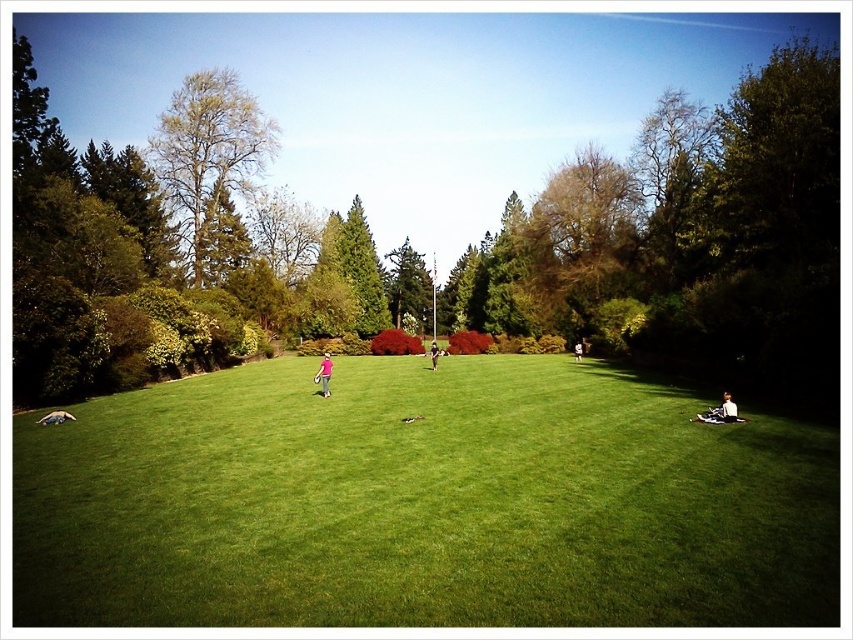
You are standing in the park and want to take a photo of the green textured tree at center and the light brown leather jacket at lower right. Which object should you focus on first to ensure both are in focus?

You should focus on the green textured tree at center first because it is closer to you than the light brown leather jacket at lower right, so focusing on it will help keep both in focus.

You are standing in the park and want to find the point at coordinates (363, 269). According to the scene description, where exactly is this point located?

The point at coordinates (363, 269) is located on the green textured tree at center.